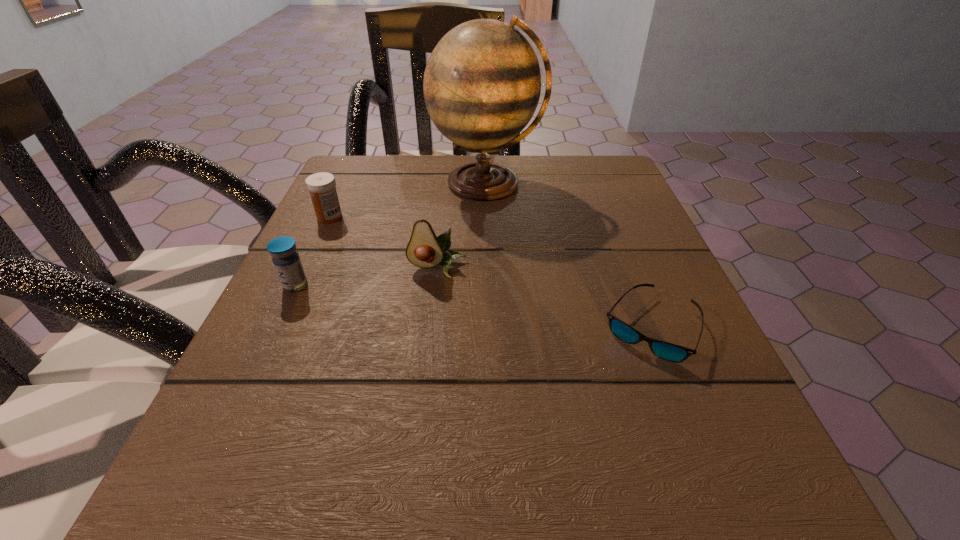
At what (x,y) coordinates should I click in order to perform the action: click on vacant area situated at the front of the sunglasses showing the lenses. Please return your answer as a coordinate pair (x, y). The width and height of the screenshot is (960, 540). Looking at the image, I should click on (699, 453).

Where is `object situated at the far edge`? This screenshot has width=960, height=540. object situated at the far edge is located at coordinates (482, 83).

In order to click on object present at the right edge in this screenshot , I will do `click(667, 351)`.

Identify the location of free space at the far edge of the desktop. (434, 199).

Where is `vacant position at the near edge of the desktop`? vacant position at the near edge of the desktop is located at coordinates (339, 458).

This screenshot has width=960, height=540. In the image, there is a desktop. Identify the location of free space at the left edge. (346, 233).

The image size is (960, 540). What are the coordinates of `vacant region at the right edge of the desktop` in the screenshot? It's located at (715, 374).

I want to click on free region at the near left corner of the desktop, so click(x=223, y=487).

At what (x,y) coordinates should I click in order to perform the action: click on vacant position at the far right corner of the desktop. Please return your answer as a coordinate pair (x, y). The height and width of the screenshot is (540, 960). Looking at the image, I should click on (597, 179).

This screenshot has width=960, height=540. Identify the location of vacant region at the near right corner of the desktop. (680, 456).